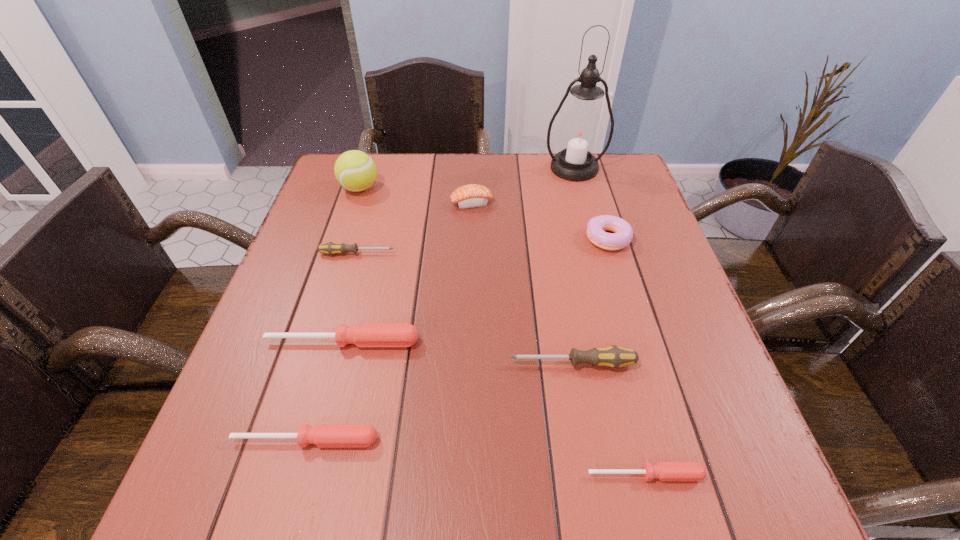
Image resolution: width=960 pixels, height=540 pixels. Identify the location of free space located 0.290m at the tip of the right gray screwdriver. (355, 363).

Find the location of a particular element. vacant area located 0.180m at the tip of the right gray screwdriver is located at coordinates (414, 363).

At what (x,y) coordinates should I click in order to perform the action: click on blank space located 0.200m at the tip of the right gray screwdriver. Please return your answer as a coordinate pair (x, y). Looking at the image, I should click on (403, 363).

You are a GUI agent. You are given a task and a screenshot of the screen. Output one action in this format:
    pyautogui.click(x=<x>, y=<y>)
    Task: Click on the vacant space situated on the back of the fourth nearest object
    This screenshot has width=960, height=540.
    Given the screenshot: What is the action you would take?
    pyautogui.click(x=350, y=314)

The width and height of the screenshot is (960, 540). What are the coordinates of `vacant point located on the back of the second nearest object` in the screenshot? It's located at (324, 379).

Find the location of `free location located 0.230m at the tip of the farthest screwdriver`. free location located 0.230m at the tip of the farthest screwdriver is located at coordinates (492, 253).

Find the location of `free space located 0.050m on the front of the nearest screwdriver`. free space located 0.050m on the front of the nearest screwdriver is located at coordinates (656, 518).

Identify the location of oil lamp present at the far edge. (580, 133).

Where is `tennis ball located at the far edge`? This screenshot has width=960, height=540. tennis ball located at the far edge is located at coordinates (x=354, y=170).

You are a GUI agent. You are given a task and a screenshot of the screen. Output one action in this format:
    pyautogui.click(x=<x>, y=<y>)
    Task: Click on the sushi that is at the far edge
    
    Given the screenshot: What is the action you would take?
    pyautogui.click(x=472, y=195)